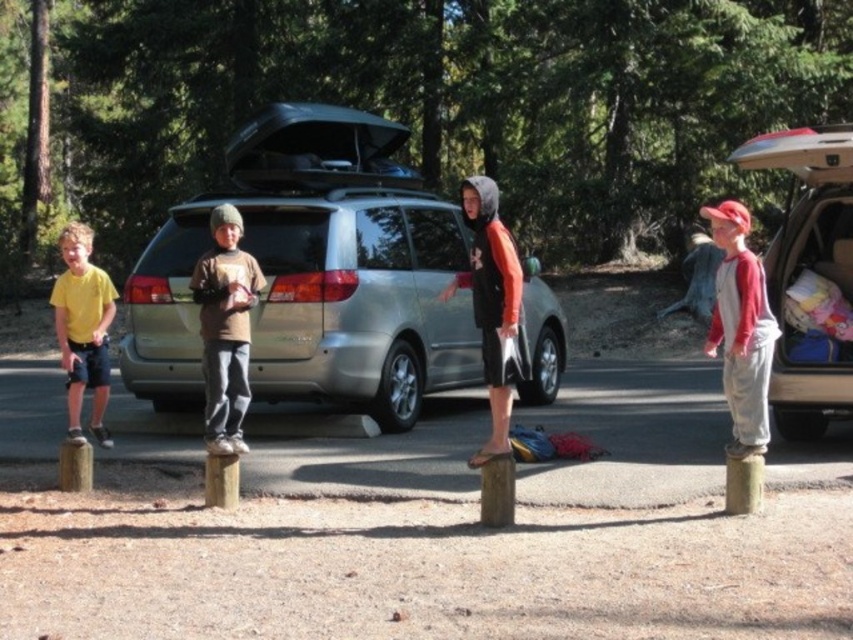
Consider the image. You are a parent trying to locate your child wearing a brown cotton shirt at center in a forest area. You see a silver metallic minivan at center. Which direction should you look relative to the minivan to find the child?

The silver metallic minivan at center is to the right of the brown cotton shirt at center, so you should look to the left of the minivan to find the child wearing the brown cotton shirt at center.